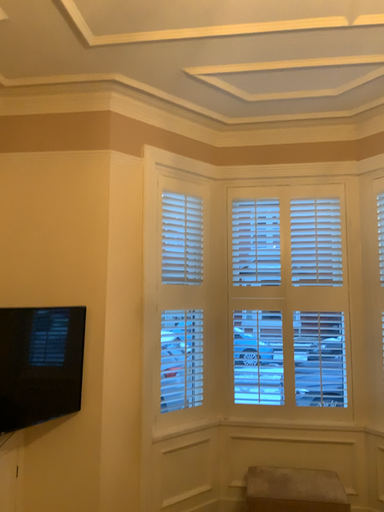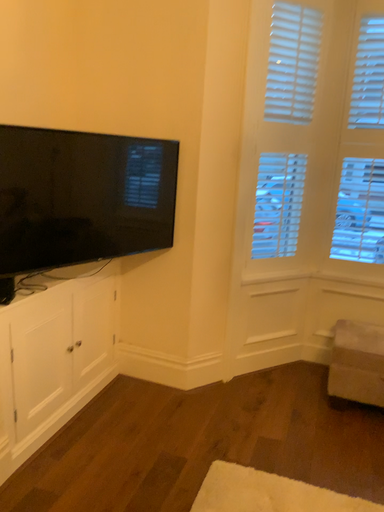
Question: How did the camera likely rotate when shooting the video?

Choices:
 (A) rotated downward
 (B) rotated upward

Answer: (A)